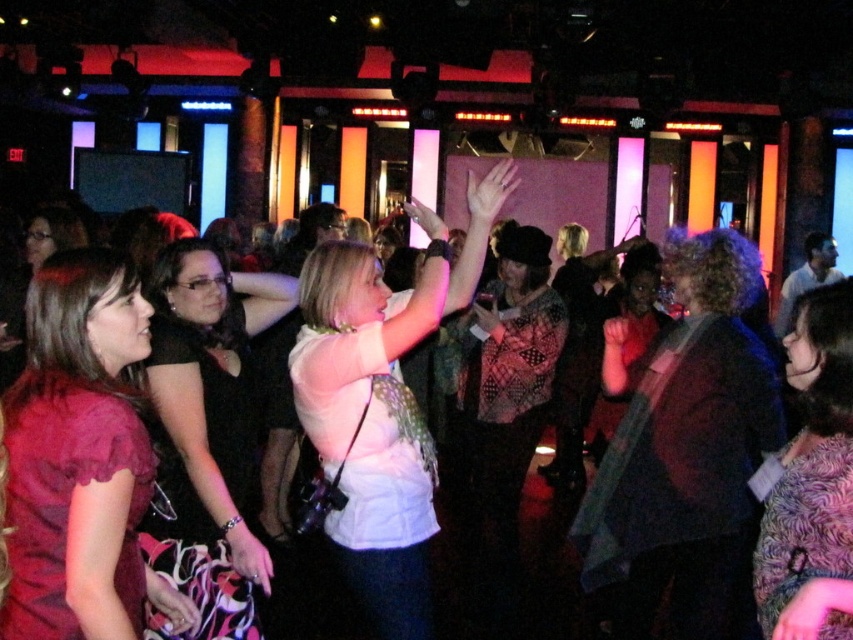
Looking at this image, does matte red dress at left have a greater height compared to black satin dress at center?

In fact, matte red dress at left may be shorter than black satin dress at center.

Who is shorter, matte red dress at left or black satin dress at center?

matte red dress at left is shorter.

Who is more forward, [138,492] or [218,476]?

Point [138,492] is more forward.

At what (x,y) coordinates should I click in order to perform the action: click on matte red dress at left. Please return your answer as a coordinate pair (x, y). Image resolution: width=853 pixels, height=640 pixels. Looking at the image, I should click on (80, 460).

Is point (717, 388) more distant than point (126, 401)?

That is True.

Can you confirm if dark brown textured jacket at center is positioned to the left of matte red dress at left?

No, dark brown textured jacket at center is not to the left of matte red dress at left.

Who is more distant from viewer, (624, 612) or (79, 317)?

Positioned behind is point (624, 612).

This screenshot has height=640, width=853. I want to click on dark brown textured jacket at center, so click(682, 445).

How distant is white matte shirt at center from black satin dress at center?

white matte shirt at center and black satin dress at center are 20.70 inches apart.

Which is behind, point (453, 284) or point (213, 292)?

Positioned behind is point (213, 292).

What do you see at coordinates (381, 401) in the screenshot? The image size is (853, 640). I see `white matte shirt at center` at bounding box center [381, 401].

Locate an element on the screen. The width and height of the screenshot is (853, 640). white matte shirt at center is located at coordinates (381, 401).